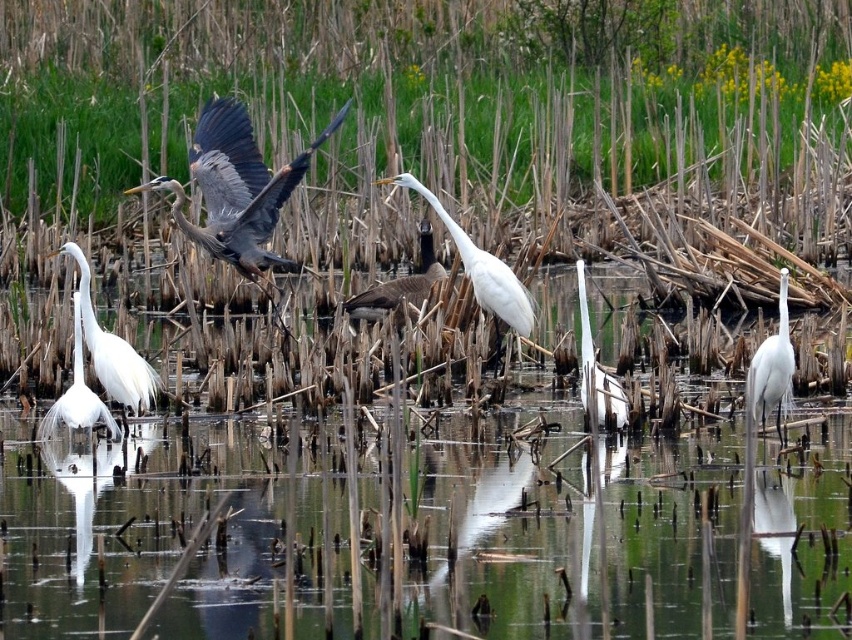
You are a photographer trying to capture the gray feathered heron at left and the clear water at center in the same frame. Based on their positions, which object is located to the right of the other?

The clear water at center is positioned on the right side of gray feathered heron at left, so the clear water at center is to the right of the gray feathered heron at left.

You are a wildlife photographer aiming to capture the white matte egret at lower left. Based on its position in the scene, which direction should you adjust your camera to focus on it from the current viewpoint?

The white matte egret at lower left is located at point (112,349), so you should adjust your camera to the lower left direction to focus on it.